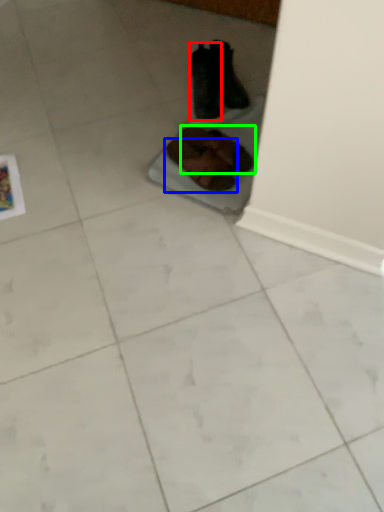
Question: Which is nearer to the footwear (highlighted by a red box)? footwear (highlighted by a blue box) or footwear (highlighted by a green box).

Choices:
 (A) footwear
 (B) footwear

Answer: (B)